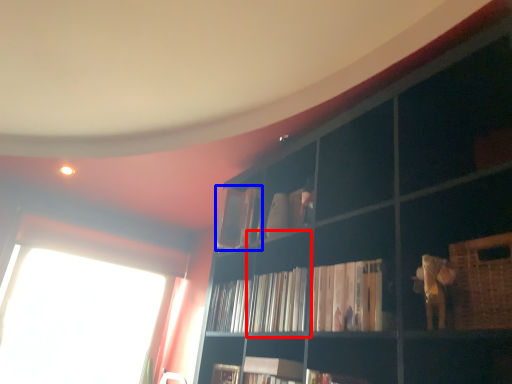
Question: Which object is closer to the camera taking this photo, cabinet (highlighted by a red box) or book (highlighted by a blue box)?

Choices:
 (A) cabinet
 (B) book

Answer: (A)